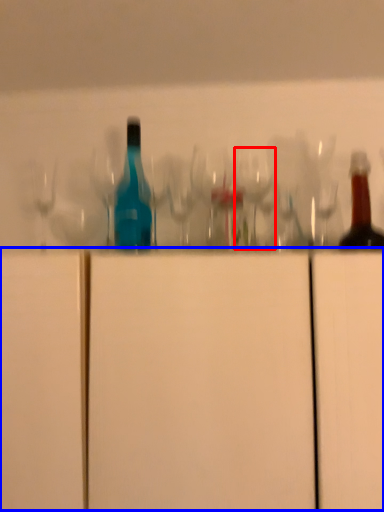
Question: Which of the following is the closest to the observer, wine glass (highlighted by a red box) or cabinetry (highlighted by a blue box)?

Choices:
 (A) wine glass
 (B) cabinetry

Answer: (B)